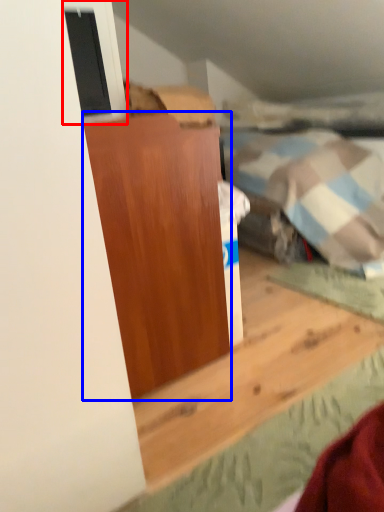
Question: Which object appears farthest to the camera in this image, window (highlighted by a red box) or furniture (highlighted by a blue box)?

Choices:
 (A) window
 (B) furniture

Answer: (A)